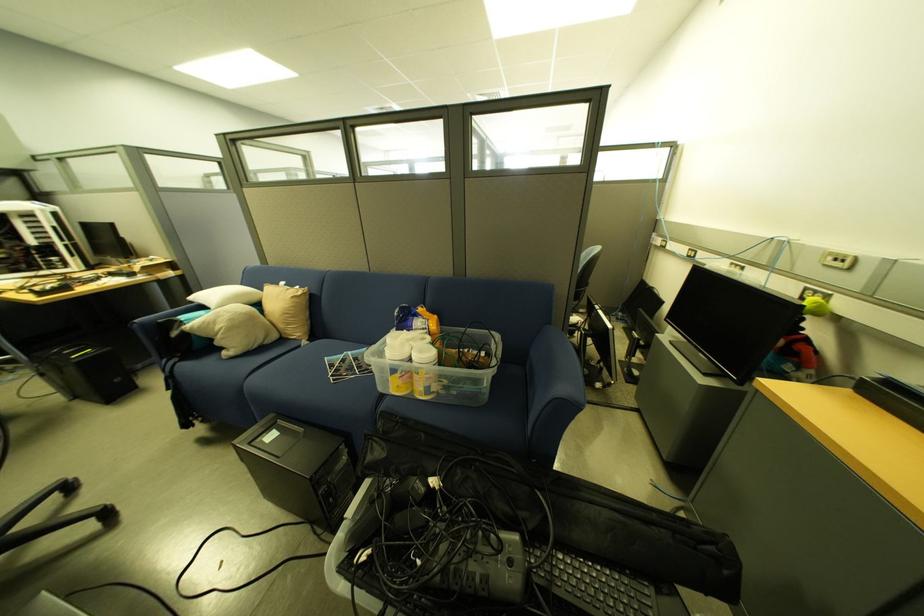
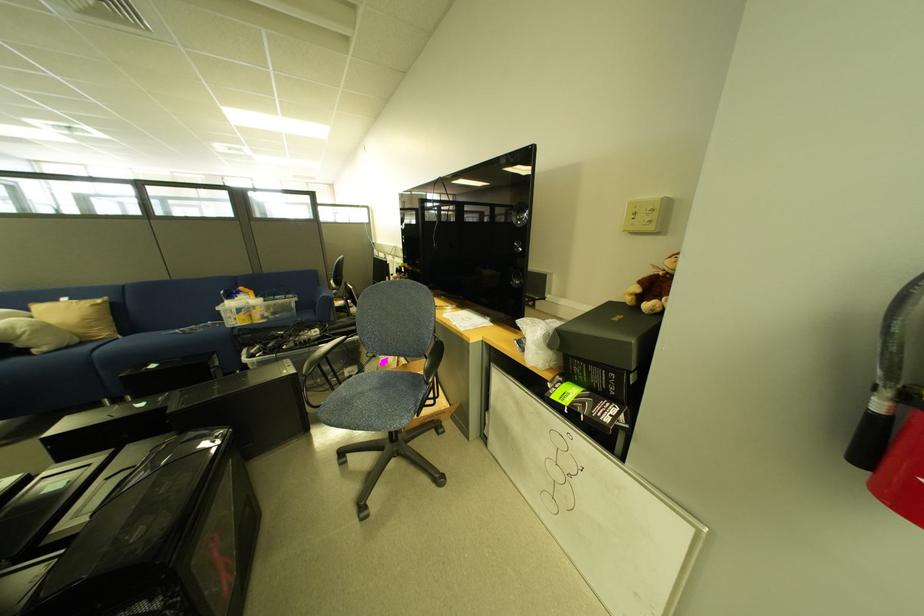
In the second image, find the point that corresponds to point 314,344 in the first image.

(130, 339)